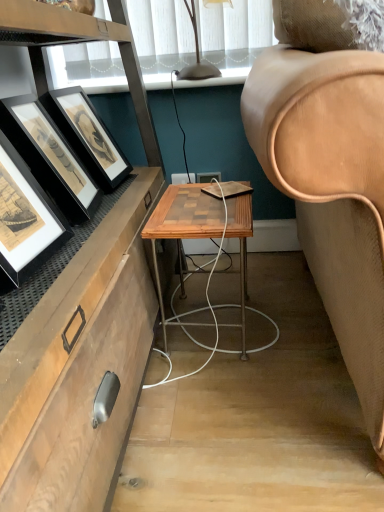
The image size is (384, 512). I want to click on black matte picture frame at left, the second picture frame from the back, so click(25, 218).

The image size is (384, 512). In order to click on matte black table lamp at upper center in this screenshot , I will do `click(197, 56)`.

Is woodenmaterial/texturetable at center taller or shorter than matte black table lamp at upper center?

Considering their sizes, woodenmaterial/texturetable at center has more height than matte black table lamp at upper center.

In terms of width, does woodenmaterial/texturetable at center look wider or thinner when compared to matte black table lamp at upper center?

Considering their sizes, woodenmaterial/texturetable at center looks broader than matte black table lamp at upper center.

Is woodenmaterial/texturetable at center inside or outside of matte black table lamp at upper center?

woodenmaterial/texturetable at center is not inside matte black table lamp at upper center, it's outside.

Is there a large distance between woodenmaterial/texturetable at center and matte black table lamp at upper center?

They are positioned close to each other.

Considering the relative sizes of matte black table lamp at upper center and woodenmaterial/texturetable at center in the image provided, is matte black table lamp at upper center shorter than woodenmaterial/texturetable at center?

Correct, matte black table lamp at upper center is not as tall as woodenmaterial/texturetable at center.

Can we say matte black table lamp at upper center lies outside woodenmaterial/texturetable at center?

Indeed, matte black table lamp at upper center is completely outside woodenmaterial/texturetable at center.

What's the angular difference between matte black table lamp at upper center and woodenmaterial/texturetable at center's facing directions?

They differ by 0.0415 degrees in their facing directions.

Image resolution: width=384 pixels, height=512 pixels. Find the location of `table on the right of matte black table lamp at upper center`. table on the right of matte black table lamp at upper center is located at coordinates (182, 226).

Do you think black matte picture frame at left, the 2th picture frame from the front, is within black matte picture frame at left, the second picture frame from the back, or outside of it?

The correct answer is: outside.

Is black matte picture frame at left, positioned as the 1th picture frame in back-to-front order, far away from black matte picture frame at left, acting as the first picture frame starting from the front?

black matte picture frame at left, positioned as the 1th picture frame in back-to-front order, is near black matte picture frame at left, acting as the first picture frame starting from the front, not far away.

Is black matte picture frame at left, positioned as the 1th picture frame in back-to-front order, oriented towards black matte picture frame at left, acting as the first picture frame starting from the front?

No.

Can you confirm if black matte picture frame at left, positioned as the 1th picture frame in back-to-front order, is positioned to the right of black matte picture frame at left, the second picture frame from the back?

Correct, you'll find black matte picture frame at left, positioned as the 1th picture frame in back-to-front order, to the right of black matte picture frame at left, the second picture frame from the back.

Considering the sizes of objects woodenmaterial/texturetable at center and black matte picture frame at left, positioned as the 1th picture frame in back-to-front order, in the image provided, who is shorter, woodenmaterial/texturetable at center or black matte picture frame at left, positioned as the 1th picture frame in back-to-front order,?

black matte picture frame at left, positioned as the 1th picture frame in back-to-front order.

From the image's perspective, is woodenmaterial/texturetable at center under black matte picture frame at left, positioned as the 1th picture frame in back-to-front order?

Indeed, from the image's perspective, woodenmaterial/texturetable at center is shown beneath black matte picture frame at left, positioned as the 1th picture frame in back-to-front order.

From a real-world perspective, which object stands above the other?

black matte picture frame at left, the 2th picture frame from the front, is physically above.

Can you confirm if woodenmaterial/texturetable at center is positioned to the right of black matte picture frame at left, positioned as the 1th picture frame in back-to-front order?

Correct, you'll find woodenmaterial/texturetable at center to the right of black matte picture frame at left, positioned as the 1th picture frame in back-to-front order.

From a real-world perspective, between matte black table lamp at upper center and black matte picture frame at left, the 2th picture frame from the front, who is vertically lower?

From a 3D spatial view, black matte picture frame at left, the 2th picture frame from the front, is below.

Is black matte picture frame at left, the 2th picture frame from the front, at the back of matte black table lamp at upper center?

matte black table lamp at upper center does not have its back to black matte picture frame at left, the 2th picture frame from the front.

Which point is more distant from viewer, (196, 29) or (55, 146)?

The point (196, 29) is more distant.

Does matte black table lamp at upper center appear on the right side of black matte picture frame at left, positioned as the 1th picture frame in back-to-front order?

Yes.

Based on the photo, from a real-world perspective, between matte black table lamp at upper center and black matte picture frame at left, acting as the first picture frame starting from the front, who is vertically lower?

black matte picture frame at left, acting as the first picture frame starting from the front, is physically lower.

Considering the sizes of matte black table lamp at upper center and black matte picture frame at left, acting as the first picture frame starting from the front, in the image, is matte black table lamp at upper center bigger or smaller than black matte picture frame at left, acting as the first picture frame starting from the front,?

matte black table lamp at upper center is smaller than black matte picture frame at left, acting as the first picture frame starting from the front.

How far apart are matte black table lamp at upper center and black matte picture frame at left, acting as the first picture frame starting from the front?

83.76 centimeters.

Based on their positions, is matte black table lamp at upper center located to the left or right of black matte picture frame at left, the second picture frame from the back?

Based on their positions, matte black table lamp at upper center is located to the right of black matte picture frame at left, the second picture frame from the back.

In terms of height, does black matte picture frame at left, positioned as the 1th picture frame in back-to-front order, look taller or shorter compared to matte black table lamp at upper center?

black matte picture frame at left, positioned as the 1th picture frame in back-to-front order, is taller than matte black table lamp at upper center.

Consider the image. From the image's perspective, does black matte picture frame at left, the 2th picture frame from the front, appear higher than matte black table lamp at upper center?

No.

Could you measure the distance between black matte picture frame at left, the 2th picture frame from the front, and matte black table lamp at upper center?

black matte picture frame at left, the 2th picture frame from the front, and matte black table lamp at upper center are 24.71 inches apart from each other.

Is black matte picture frame at left, positioned as the 1th picture frame in back-to-front order, facing towards matte black table lamp at upper center?

No, black matte picture frame at left, positioned as the 1th picture frame in back-to-front order, does not turn towards matte black table lamp at upper center.

In order to click on table below the matte black table lamp at upper center (from the image's perspective) in this screenshot , I will do `click(182, 226)`.

Image resolution: width=384 pixels, height=512 pixels. I want to click on table lamp above the woodenmaterial/texturetable at center (from the image's perspective), so click(x=197, y=56).

Based on their spatial positions, is black matte picture frame at left, positioned as the 1th picture frame in back-to-front order, or black matte picture frame at left, acting as the first picture frame starting from the front, further from matte black table lamp at upper center?

black matte picture frame at left, acting as the first picture frame starting from the front.

Considering their positions, is matte black table lamp at upper center positioned further to woodenmaterial/texturetable at center than black matte picture frame at left, the second picture frame from the back?

matte black table lamp at upper center is further to woodenmaterial/texturetable at center.

Based on their spatial positions, is woodenmaterial/texturetable at center or matte black table lamp at upper center further from black matte picture frame at left, the 2th picture frame from the front?

matte black table lamp at upper center lies further to black matte picture frame at left, the 2th picture frame from the front, than the other object.

Which object lies nearer to the anchor point black matte picture frame at left, the second picture frame from the back, black matte picture frame at left, positioned as the 1th picture frame in back-to-front order, or woodenmaterial/texturetable at center?

Based on the image, black matte picture frame at left, positioned as the 1th picture frame in back-to-front order, appears to be nearer to black matte picture frame at left, the second picture frame from the back.

Looking at the image, which one is located closer to matte black table lamp at upper center, woodenmaterial/texturetable at center or black matte picture frame at left, the 2th picture frame from the front?

woodenmaterial/texturetable at center is closer to matte black table lamp at upper center.

Based on their spatial positions, is woodenmaterial/texturetable at center or black matte picture frame at left, the second picture frame from the back, closer to black matte picture frame at left, the 2th picture frame from the front?

black matte picture frame at left, the second picture frame from the back.

Considering their positions, is black matte picture frame at left, the second picture frame from the back, positioned further to black matte picture frame at left, the 2th picture frame from the front, than matte black table lamp at upper center?

The object further to black matte picture frame at left, the 2th picture frame from the front, is matte black table lamp at upper center.

Based on their spatial positions, is woodenmaterial/texturetable at center or black matte picture frame at left, acting as the first picture frame starting from the front, closer to matte black table lamp at upper center?

woodenmaterial/texturetable at center lies closer to matte black table lamp at upper center than the other object.

This screenshot has width=384, height=512. Find the location of `picture frame between black matte picture frame at left, acting as the first picture frame starting from the front, and matte black table lamp at upper center, along the z-axis`. picture frame between black matte picture frame at left, acting as the first picture frame starting from the front, and matte black table lamp at upper center, along the z-axis is located at coordinates (49, 157).

Locate an element on the screen. The width and height of the screenshot is (384, 512). picture frame between black matte picture frame at left, acting as the first picture frame starting from the front, and woodenmaterial/texturetable at center is located at coordinates (49, 157).